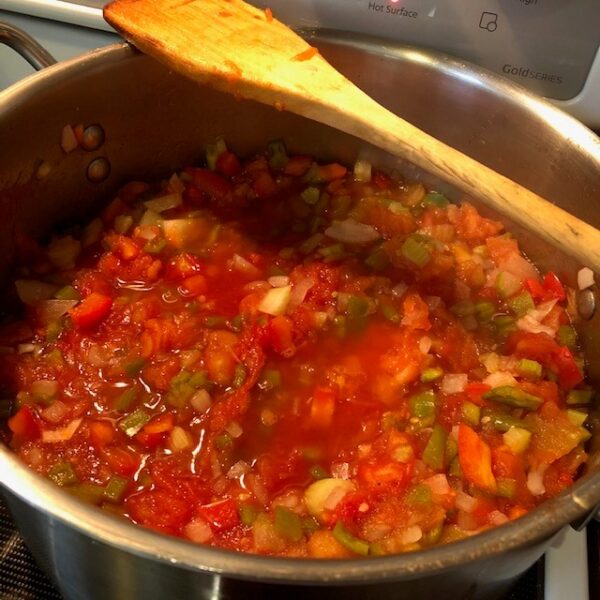
This screenshot has height=600, width=600. I want to click on stove control panel, so click(538, 30).